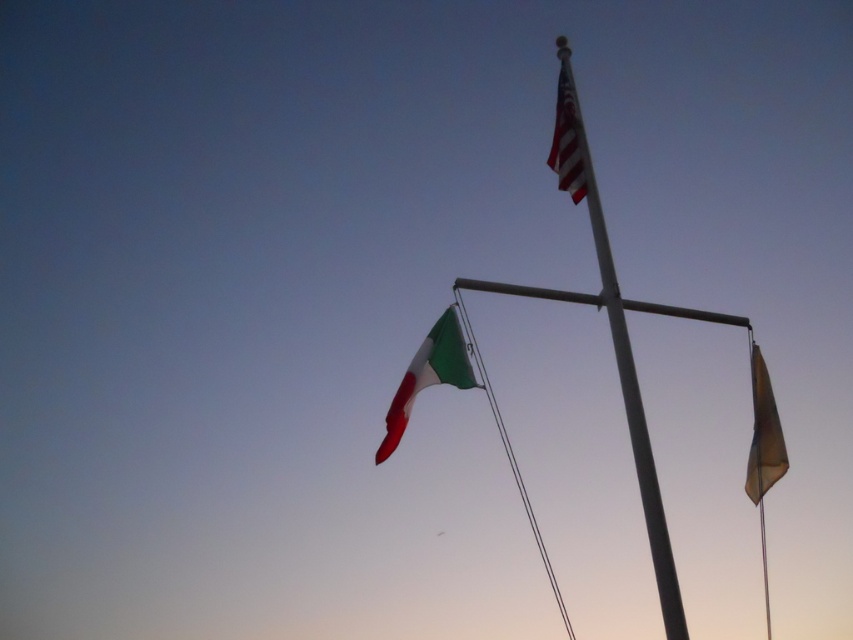
Does white metallic mast at center have a greater width compared to green-white-red fabric flag at center?

Correct, the width of white metallic mast at center exceeds that of green-white-red fabric flag at center.

Is point (566, 298) farther from camera compared to point (393, 419)?

Yes, point (566, 298) is farther from viewer.

Where is `white metallic mast at center`? The image size is (853, 640). white metallic mast at center is located at coordinates pos(625,388).

Can you confirm if white metallic mast at center is taller than white metallic flag pole at center?

Yes.

Is white metallic mast at center closer to the viewer compared to white metallic flag pole at center?

Yes.

You are a GUI agent. You are given a task and a screenshot of the screen. Output one action in this format:
    pyautogui.click(x=<x>, y=<y>)
    Task: Click on the white metallic mast at center
    Image resolution: width=853 pixels, height=640 pixels.
    Given the screenshot: What is the action you would take?
    pyautogui.click(x=625, y=388)

Identify the location of white metallic mast at center. pos(625,388).

Looking at this image, is green-white-red fabric flag at center further to camera compared to white striped fabric flag at upper center?

That is False.

From the picture: Who is taller, green-white-red fabric flag at center or white striped fabric flag at upper center?

white striped fabric flag at upper center is taller.

Is point (462, 356) positioned after point (579, 154)?

No, it is not.

This screenshot has height=640, width=853. In order to click on green-white-red fabric flag at center in this screenshot , I will do `click(428, 376)`.